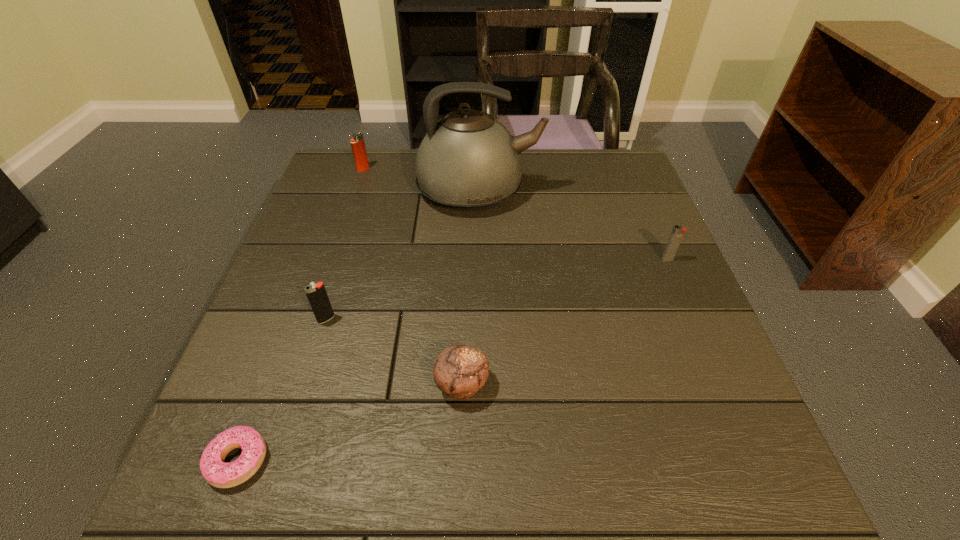
This screenshot has width=960, height=540. I want to click on vacant space situated 0.180m on the front of the fourth farthest object, so click(300, 404).

I want to click on vacant area situated on the left of the rightmost igniter, so click(560, 259).

I want to click on free space located on the back of the second nearest object, so click(467, 253).

Find the location of `vacant region located on the back of the shortest object`. vacant region located on the back of the shortest object is located at coordinates (282, 345).

The width and height of the screenshot is (960, 540). What are the coordinates of `kettle that is at the far edge` in the screenshot? It's located at (468, 161).

Locate an element on the screen. igniter that is at the far edge is located at coordinates (357, 142).

The image size is (960, 540). In order to click on object that is at the near edge in this screenshot , I will do `click(216, 472)`.

You are a GUI agent. You are given a task and a screenshot of the screen. Output one action in this format:
    pyautogui.click(x=<x>, y=<y>)
    Task: Click on the doughnut located in the left edge section of the desktop
    The height and width of the screenshot is (540, 960).
    Given the screenshot: What is the action you would take?
    pyautogui.click(x=216, y=472)

The image size is (960, 540). What are the coordinates of `object at the right edge` in the screenshot? It's located at (678, 231).

Where is `object that is at the far left corner`? This screenshot has width=960, height=540. object that is at the far left corner is located at coordinates (357, 142).